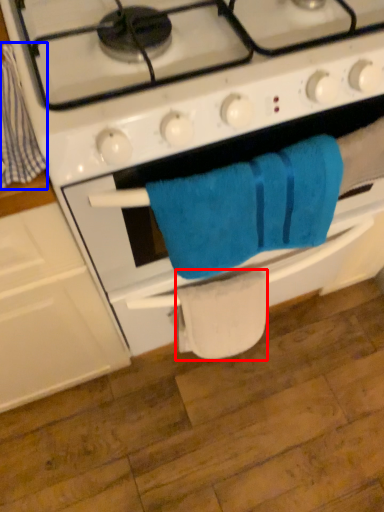
Question: Which object is further to the camera taking this photo, toilet paper (highlighted by a red box) or beach towel (highlighted by a blue box)?

Choices:
 (A) toilet paper
 (B) beach towel

Answer: (A)